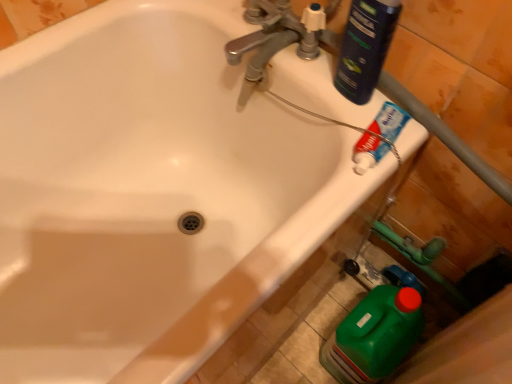
Where is `white glossy toothpaste at upper right`? The width and height of the screenshot is (512, 384). white glossy toothpaste at upper right is located at coordinates (368, 152).

I want to click on silver metallic faucet at upper center, so (273, 39).

Measure the distance from dark blue plastic bottle at upper right, the second cleaning product positioned from the bottom, to green plastic container at lower right, placed as the 2th cleaning product when sorted from front to back.

They are 19.69 inches apart.

Is dark blue plastic bottle at upper right, arranged as the second cleaning product when viewed from the back, facing towards green plastic container at lower right, which is counted as the first cleaning product, starting from the bottom?

No, dark blue plastic bottle at upper right, arranged as the second cleaning product when viewed from the back, is not oriented towards green plastic container at lower right, which is counted as the first cleaning product, starting from the bottom.

Considering the sizes of objects dark blue plastic bottle at upper right, which appears as the first cleaning product when viewed from the front, and green plastic container at lower right, placed as the 2th cleaning product when sorted from front to back, in the image provided, who is wider, dark blue plastic bottle at upper right, which appears as the first cleaning product when viewed from the front, or green plastic container at lower right, placed as the 2th cleaning product when sorted from front to back,?

green plastic container at lower right, placed as the 2th cleaning product when sorted from front to back, is wider.

From the picture: Can you confirm if dark blue plastic bottle at upper right, the second cleaning product positioned from the bottom, is smaller than green plastic container at lower right, which is the 2th cleaning product in top-to-bottom order?

Correct, dark blue plastic bottle at upper right, the second cleaning product positioned from the bottom, occupies less space than green plastic container at lower right, which is the 2th cleaning product in top-to-bottom order.

Can you confirm if green plastic container at lower right, which is the 2th cleaning product in top-to-bottom order, is bigger than dark blue plastic bottle at upper right, the second cleaning product positioned from the bottom?

Yes, green plastic container at lower right, which is the 2th cleaning product in top-to-bottom order, is bigger than dark blue plastic bottle at upper right, the second cleaning product positioned from the bottom.

Based on the photo, is green plastic container at lower right, which is counted as the first cleaning product, starting from the bottom, looking in the opposite direction of dark blue plastic bottle at upper right, the second cleaning product positioned from the bottom?

No, green plastic container at lower right, which is counted as the first cleaning product, starting from the bottom, is not facing the opposite direction of dark blue plastic bottle at upper right, the second cleaning product positioned from the bottom.

The width and height of the screenshot is (512, 384). I want to click on cleaning product located above the green plastic container at lower right, which is counted as the first cleaning product, starting from the bottom (from the image's perspective), so click(365, 47).

Which object is further away from the camera taking this photo, green plastic container at lower right, placed as the 2th cleaning product when sorted from front to back, or dark blue plastic bottle at upper right, arranged as the second cleaning product when viewed from the back?

green plastic container at lower right, placed as the 2th cleaning product when sorted from front to back, is further away from the camera.

Is white glossy toothpaste at upper right oriented away from silver metallic faucet at upper center?

No, white glossy toothpaste at upper right is not facing the opposite direction of silver metallic faucet at upper center.

How different are the orientations of white glossy toothpaste at upper right and silver metallic faucet at upper center in degrees?

There is a 13.6-degree angle between the facing directions of white glossy toothpaste at upper right and silver metallic faucet at upper center.

Is white glossy toothpaste at upper right behind silver metallic faucet at upper center?

No, white glossy toothpaste at upper right is closer to the camera.

You are a GUI agent. You are given a task and a screenshot of the screen. Output one action in this format:
    pyautogui.click(x=<x>, y=<y>)
    Task: Click on the toothpaste below the silver metallic faucet at upper center (from the image's perspective)
    
    Given the screenshot: What is the action you would take?
    pyautogui.click(x=368, y=152)

Is silver metallic faucet at upper center facing towards green plastic container at lower right, which is the first cleaning product in back-to-front order?

No, silver metallic faucet at upper center is not turned towards green plastic container at lower right, which is the first cleaning product in back-to-front order.

Which is closer to the camera, (264, 74) or (392, 292)?

The point (264, 74) is closer to the camera.

Is silver metallic faucet at upper center smaller than green plastic container at lower right, placed as the 2th cleaning product when sorted from front to back?

Indeed, silver metallic faucet at upper center has a smaller size compared to green plastic container at lower right, placed as the 2th cleaning product when sorted from front to back.

Which is less distant, (356, 173) or (389, 357)?

Point (356, 173).

Considering the sizes of objects white glossy toothpaste at upper right and green plastic container at lower right, which is counted as the first cleaning product, starting from the bottom, in the image provided, who is wider, white glossy toothpaste at upper right or green plastic container at lower right, which is counted as the first cleaning product, starting from the bottom,?

green plastic container at lower right, which is counted as the first cleaning product, starting from the bottom, is wider.

Could you measure the distance between white glossy toothpaste at upper right and green plastic container at lower right, which is counted as the first cleaning product, starting from the bottom?

white glossy toothpaste at upper right is 16.42 inches from green plastic container at lower right, which is counted as the first cleaning product, starting from the bottom.

Would you consider white glossy toothpaste at upper right to be distant from green plastic container at lower right, which is counted as the first cleaning product, starting from the bottom?

No, white glossy toothpaste at upper right is in close proximity to green plastic container at lower right, which is counted as the first cleaning product, starting from the bottom.

In the scene shown: Can we say dark blue plastic bottle at upper right, arranged as the second cleaning product when viewed from the back, lies outside silver metallic faucet at upper center?

Yes, dark blue plastic bottle at upper right, arranged as the second cleaning product when viewed from the back, is not within silver metallic faucet at upper center.

From the picture: Which object is thinner, dark blue plastic bottle at upper right, arranged as the second cleaning product when viewed from the back, or silver metallic faucet at upper center?

Thinner between the two is dark blue plastic bottle at upper right, arranged as the second cleaning product when viewed from the back.

From a real-world perspective, is dark blue plastic bottle at upper right, which appears as the first cleaning product when viewed from the front, located higher than silver metallic faucet at upper center?

Indeed, from a real-world perspective, dark blue plastic bottle at upper right, which appears as the first cleaning product when viewed from the front, stands above silver metallic faucet at upper center.

Considering the sizes of objects dark blue plastic bottle at upper right, which appears as the first cleaning product when viewed from the front, and silver metallic faucet at upper center in the image provided, who is taller, dark blue plastic bottle at upper right, which appears as the first cleaning product when viewed from the front, or silver metallic faucet at upper center?

Standing taller between the two is dark blue plastic bottle at upper right, which appears as the first cleaning product when viewed from the front.

Is silver metallic faucet at upper center bigger than dark blue plastic bottle at upper right, arranged as the second cleaning product when viewed from the back?

Indeed, silver metallic faucet at upper center has a larger size compared to dark blue plastic bottle at upper right, arranged as the second cleaning product when viewed from the back.

Considering the positions of objects silver metallic faucet at upper center and dark blue plastic bottle at upper right, the second cleaning product positioned from the bottom, in the image provided, who is in front, silver metallic faucet at upper center or dark blue plastic bottle at upper right, the second cleaning product positioned from the bottom,?

dark blue plastic bottle at upper right, the second cleaning product positioned from the bottom, is in front.

Find the location of a particular element. This screenshot has width=512, height=384. tap below the dark blue plastic bottle at upper right, arranged as the second cleaning product when viewed from the back (from a real-world perspective) is located at coordinates (273, 39).

Which object is positioned more to the left, silver metallic faucet at upper center or dark blue plastic bottle at upper right, the second cleaning product positioned from the bottom?

From the viewer's perspective, silver metallic faucet at upper center appears more on the left side.

Where is `cleaning product that is behind the dark blue plastic bottle at upper right, which appears as the 1th cleaning product when viewed from the top`? The image size is (512, 384). cleaning product that is behind the dark blue plastic bottle at upper right, which appears as the 1th cleaning product when viewed from the top is located at coordinates (374, 336).

At what (x,y) coordinates should I click in order to perform the action: click on cleaning product in front of the green plastic container at lower right, which is counted as the first cleaning product, starting from the bottom. Please return your answer as a coordinate pair (x, y). Looking at the image, I should click on (365, 47).

When comparing their distances from green plastic container at lower right, which is the first cleaning product in back-to-front order, does dark blue plastic bottle at upper right, the second cleaning product positioned from the bottom, or white glossy toothpaste at upper right seem further?

Based on the image, dark blue plastic bottle at upper right, the second cleaning product positioned from the bottom, appears to be further to green plastic container at lower right, which is the first cleaning product in back-to-front order.

Considering their positions, is white glossy toothpaste at upper right positioned closer to silver metallic faucet at upper center than green plastic container at lower right, placed as the 2th cleaning product when sorted from front to back?

white glossy toothpaste at upper right is closer to silver metallic faucet at upper center.

Based on their spatial positions, is white glossy toothpaste at upper right or dark blue plastic bottle at upper right, the second cleaning product positioned from the bottom, closer to green plastic container at lower right, which is the 2th cleaning product in top-to-bottom order?

white glossy toothpaste at upper right is positioned closer to the anchor green plastic container at lower right, which is the 2th cleaning product in top-to-bottom order.

Estimate the real-world distances between objects in this image. Which object is further from dark blue plastic bottle at upper right, the second cleaning product positioned from the bottom, silver metallic faucet at upper center or green plastic container at lower right, placed as the 2th cleaning product when sorted from front to back?

Among the two, green plastic container at lower right, placed as the 2th cleaning product when sorted from front to back, is located further to dark blue plastic bottle at upper right, the second cleaning product positioned from the bottom.

In the scene shown: When comparing their distances from silver metallic faucet at upper center, does green plastic container at lower right, which is counted as the first cleaning product, starting from the bottom, or white glossy toothpaste at upper right seem further?

Based on the image, green plastic container at lower right, which is counted as the first cleaning product, starting from the bottom, appears to be further to silver metallic faucet at upper center.

Based on the photo, when comparing their distances from white glossy toothpaste at upper right, does green plastic container at lower right, placed as the 2th cleaning product when sorted from front to back, or dark blue plastic bottle at upper right, which appears as the 1th cleaning product when viewed from the top, seem closer?

dark blue plastic bottle at upper right, which appears as the 1th cleaning product when viewed from the top.

Estimate the real-world distances between objects in this image. Which object is closer to green plastic container at lower right, which is the 2th cleaning product in top-to-bottom order, silver metallic faucet at upper center or white glossy toothpaste at upper right?

Based on the image, white glossy toothpaste at upper right appears to be nearer to green plastic container at lower right, which is the 2th cleaning product in top-to-bottom order.

Considering their positions, is dark blue plastic bottle at upper right, which appears as the 1th cleaning product when viewed from the top, positioned further to white glossy toothpaste at upper right than green plastic container at lower right, which is the first cleaning product in back-to-front order?

Among the two, green plastic container at lower right, which is the first cleaning product in back-to-front order, is located further to white glossy toothpaste at upper right.

Locate an element on the screen. The height and width of the screenshot is (384, 512). cleaning product between silver metallic faucet at upper center and white glossy toothpaste at upper right in the vertical direction is located at coordinates (365, 47).

Locate an element on the screen. The width and height of the screenshot is (512, 384). cleaning product between silver metallic faucet at upper center and green plastic container at lower right, which is the first cleaning product in back-to-front order, vertically is located at coordinates pyautogui.click(x=365, y=47).

I want to click on toothpaste between silver metallic faucet at upper center and green plastic container at lower right, which is counted as the first cleaning product, starting from the bottom, in the vertical direction, so click(368, 152).

Find the location of `toothpaste between dark blue plastic bottle at upper right, the second cleaning product positioned from the bottom, and green plastic container at lower right, which is counted as the first cleaning product, starting from the bottom, vertically`. toothpaste between dark blue plastic bottle at upper right, the second cleaning product positioned from the bottom, and green plastic container at lower right, which is counted as the first cleaning product, starting from the bottom, vertically is located at coordinates (368, 152).